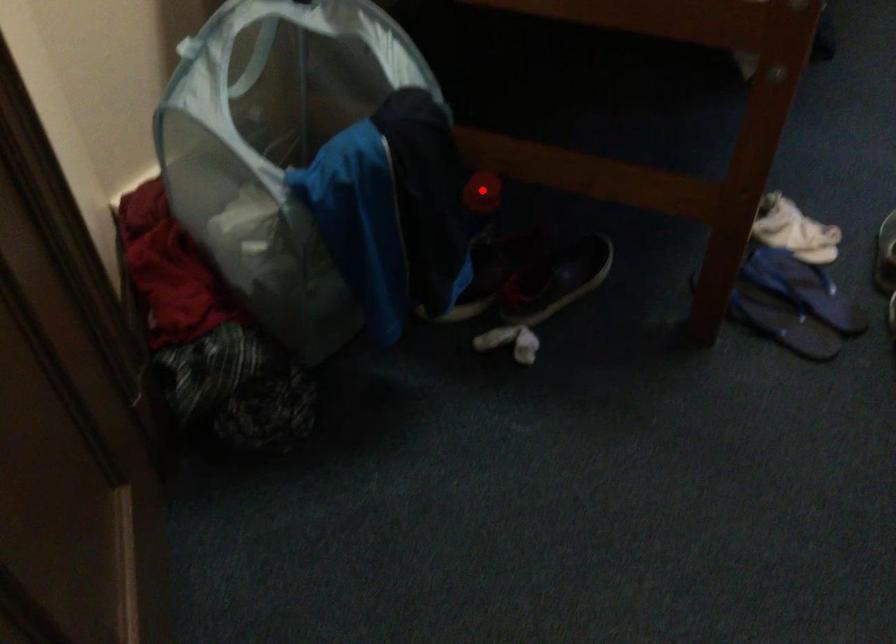
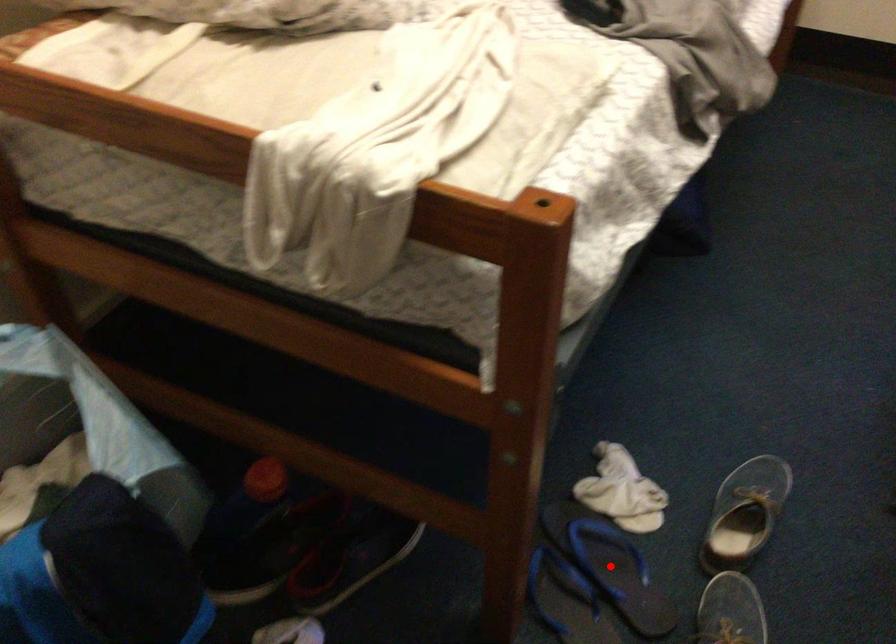
I am providing you with two images of the same scene from different viewpoints. A red point is marked on the first image and another point is marked on the second image. Are the points marked in image1 and image2 representing the same 3D position?

No